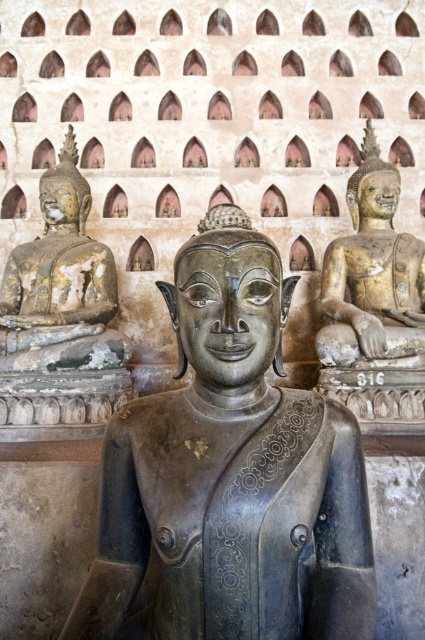
Which of these two, bronze statue at center or gold-bronze statue at right, stands taller?

gold-bronze statue at right is taller.

Who is more forward, (x=122, y=476) or (x=371, y=144)?

Positioned in front is point (x=122, y=476).

Which is behind, point (249, 244) or point (343, 314)?

Point (343, 314)

At what (x,y) coordinates should I click in order to perform the action: click on bronze statue at center. Please return your answer as a coordinate pair (x, y). Image resolution: width=425 pixels, height=640 pixels. Looking at the image, I should click on (232, 474).